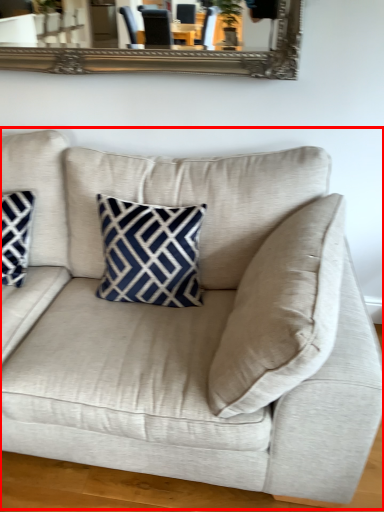
Question: From the image's perspective, what is the correct spatial positioning of studio couch (annotated by the red box) in reference to pillow?

Choices:
 (A) above
 (B) below

Answer: (B)